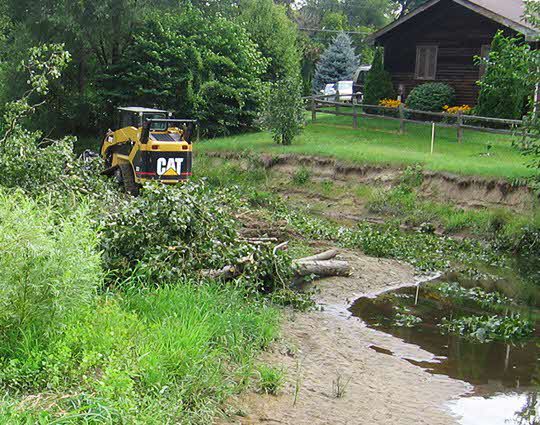
The width and height of the screenshot is (540, 425). In order to click on window in this screenshot , I will do `click(429, 65)`.